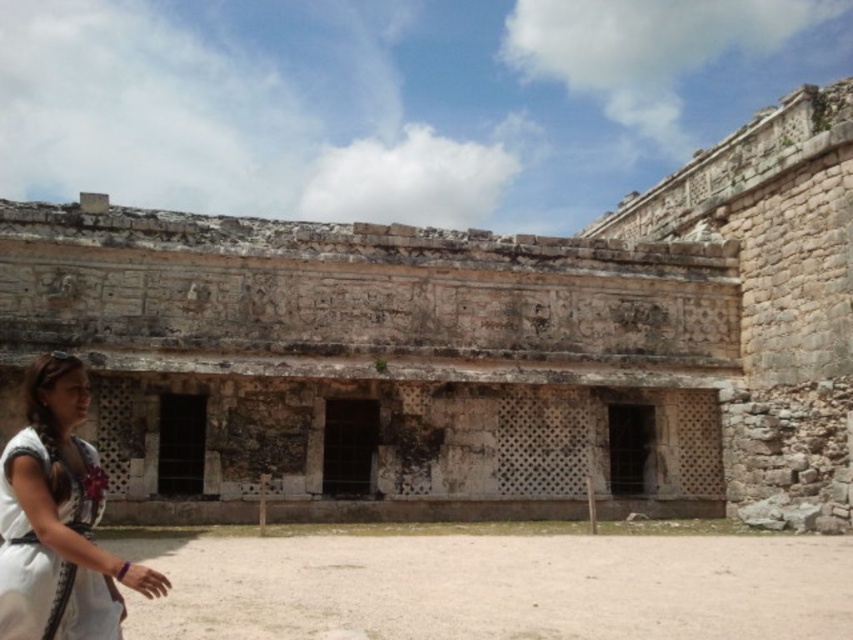
Between weathered stone ruins at center and white fabric dress at lower left, which one is positioned higher?

Positioned higher is weathered stone ruins at center.

Is point (647, 307) farther from camera compared to point (90, 484)?

That is True.

Identify the location of weathered stone ruins at center. This screenshot has height=640, width=853. (466, 348).